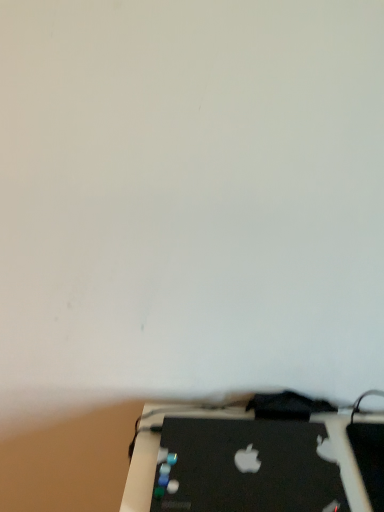
What are the coordinates of `black matte laptop at lower center` in the screenshot? It's located at (254, 461).

Measure the distance between black matte laptop at lower center and camera.

25.43 inches.

The height and width of the screenshot is (512, 384). What do you see at coordinates (254, 461) in the screenshot?
I see `black matte laptop at lower center` at bounding box center [254, 461].

You are a GUI agent. You are given a task and a screenshot of the screen. Output one action in this format:
    pyautogui.click(x=<x>, y=<y>)
    Task: Click on the black matte laptop at lower center
    The height and width of the screenshot is (512, 384).
    Given the screenshot: What is the action you would take?
    pyautogui.click(x=254, y=461)